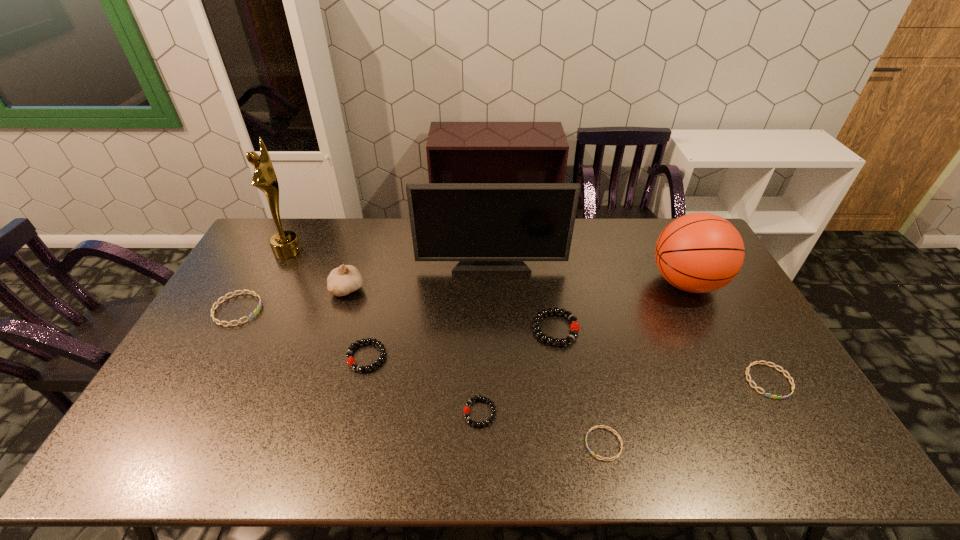
This screenshot has width=960, height=540. Identify the location of free space located 0.190m on the left of the basketball. (592, 282).

Identify the location of vacant area situated on the front of the seventh shortest object. (324, 361).

This screenshot has height=540, width=960. Find the location of `vacant space located 0.200m on the left of the rightmost black bracelet`. vacant space located 0.200m on the left of the rightmost black bracelet is located at coordinates (468, 329).

The width and height of the screenshot is (960, 540). What are the coordinates of `free location located on the surface of the biggest blue bracelet showing star-shaped elements` in the screenshot? It's located at (380, 310).

Identify the location of free point located on the back of the leftmost black bracelet. This screenshot has width=960, height=540. (385, 278).

Image resolution: width=960 pixels, height=540 pixels. I want to click on vacant region located 0.150m on the surface of the second smallest blue bracelet showing star-shaped elements, so click(811, 455).

Find the location of a particular element. This screenshot has height=540, width=960. vacant region located 0.060m on the right of the second black bracelet from left to right is located at coordinates pyautogui.click(x=520, y=413).

The image size is (960, 540). I want to click on vacant space situated 0.250m on the surface of the shortest bracelet showing star-shaped elements, so 483,444.

Where is `free region located 0.180m on the surface of the shortest bracelet showing star-shaped elements`? free region located 0.180m on the surface of the shortest bracelet showing star-shaped elements is located at coordinates (512, 444).

Locate an element on the screen. The height and width of the screenshot is (540, 960). vacant region located 0.070m on the surface of the shortest bracelet showing star-shaped elements is located at coordinates (557, 444).